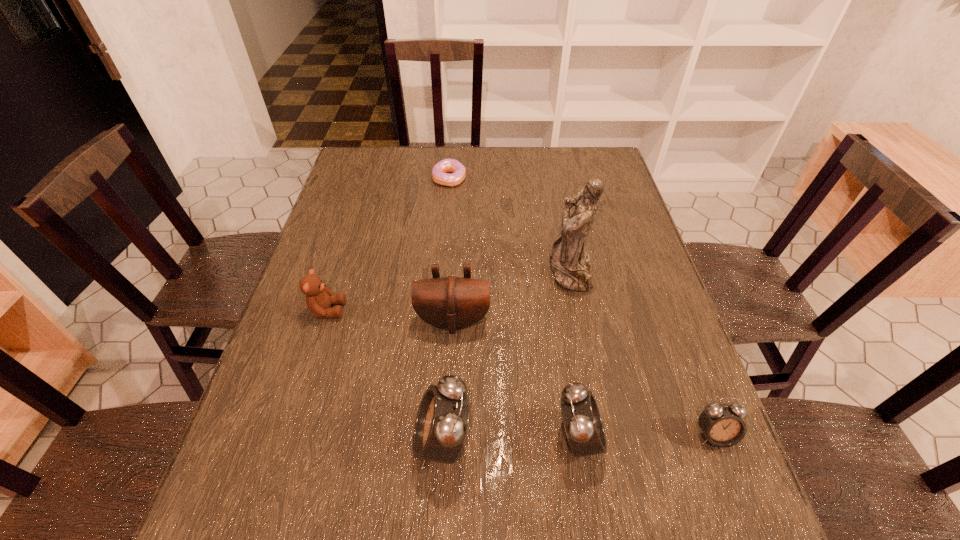
All alarm clocks are currently evenly spaced. To continue this pattern, where would you add another alarm clock on the left? Please point out a vacant spot. Please provide its 2D coordinates. Your answer should be formatted as a tuple, i.e. [(x, y)], where the tuple contains the x and y coordinates of a point satisfying the conditions above.

[(304, 443)]